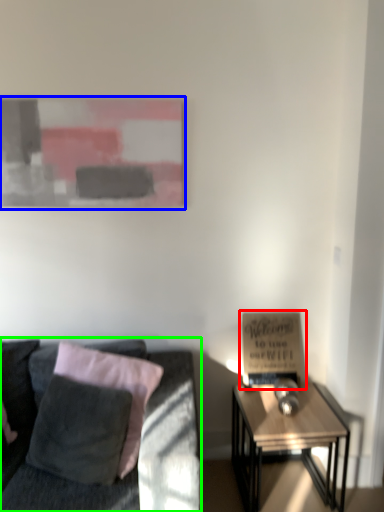
Question: Based on their relative distances, which object is farther from bulletin board (highlighted by a red box)? Choose from picture frame (highlighted by a blue box) and studio couch (highlighted by a green box).

Choices:
 (A) picture frame
 (B) studio couch

Answer: (A)